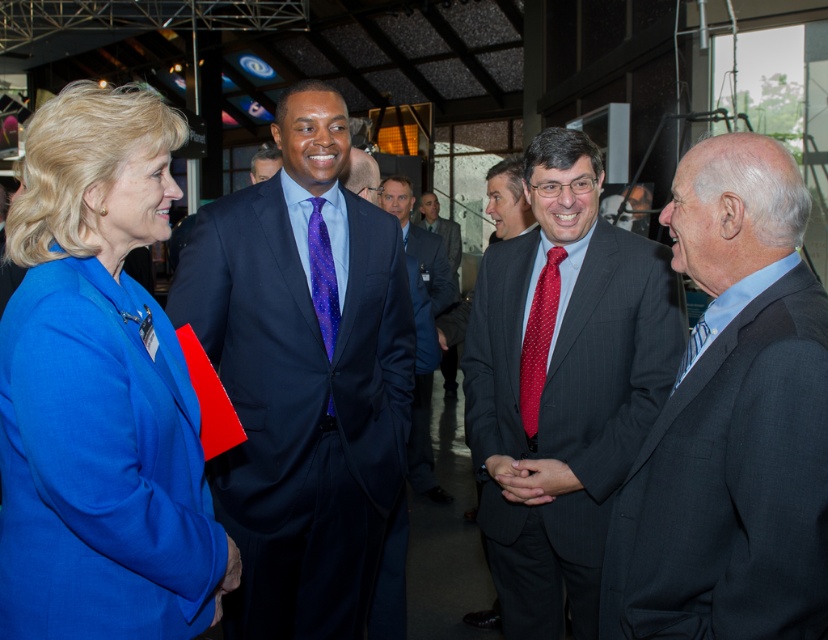
Consider the image. You are a photographer at the event and need to capture a photo of both the dark gray pinstripe suit at center and the dark blue suit at center. Which one should you focus on first if you want to ensure both are in the frame without moving the camera?

You should focus on the dark gray pinstripe suit at center first because it is above the dark blue suit at center, so adjusting the camera to include the upper subject first will help capture both in the frame.

You are standing at the entrance of the conference hall and see two points marked in the image. The first point is at coordinates point (63,248) and the second point is at point (593,442). Which point is closer to you?

Point (63,248) is in front of point (593,442), so it is closer to you.

You are a photographer at a formal event. You need to take a photo of the matte blue suit at center and the purple dotted fabric tie at center. Which one will be more visible in the photo?

The matte blue suit at center will be more visible in the photo because it is in front of the purple dotted fabric tie at center, making it closer to the camera and thus more prominent in the frame.